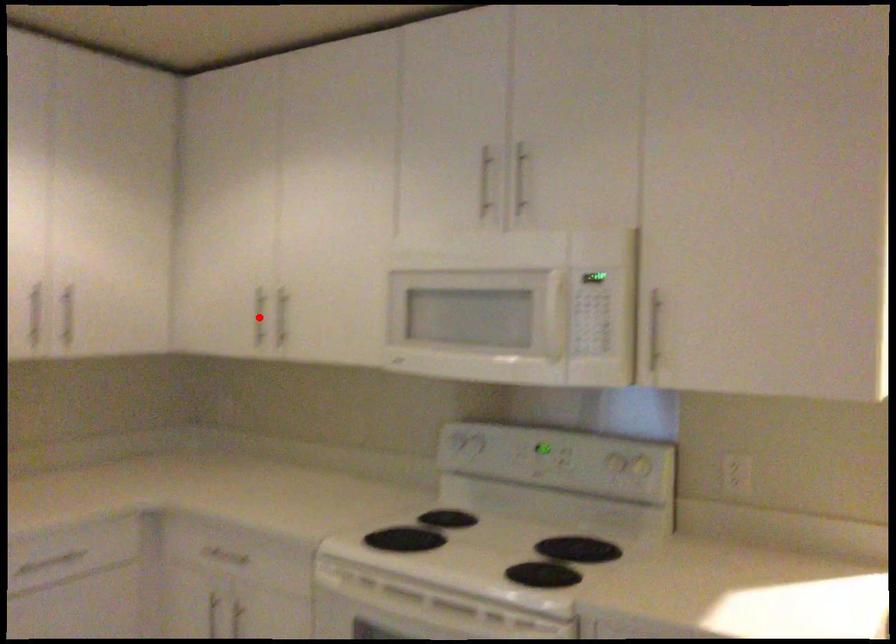
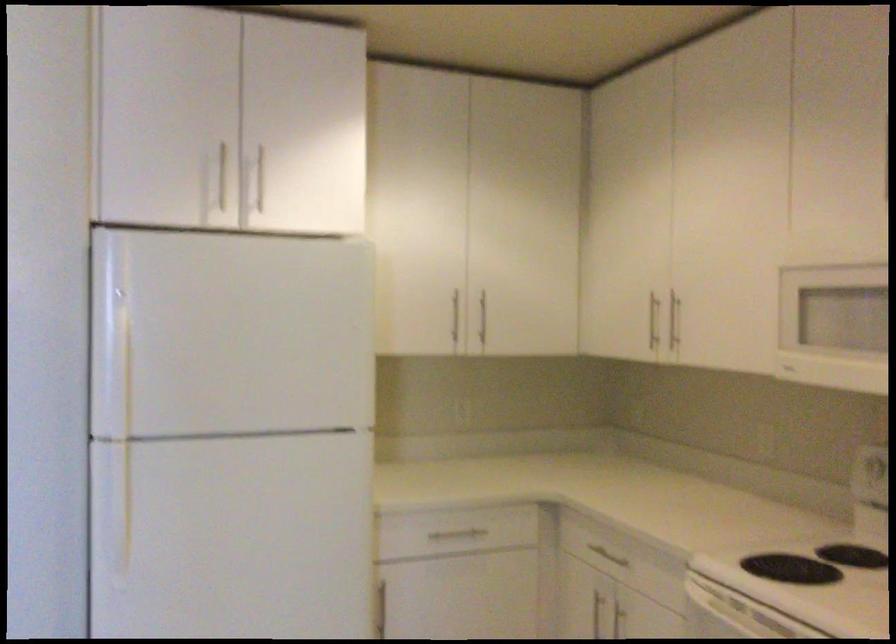
Where in the second image is the point corresponding to the highlighted location from the first image?

(652, 321)